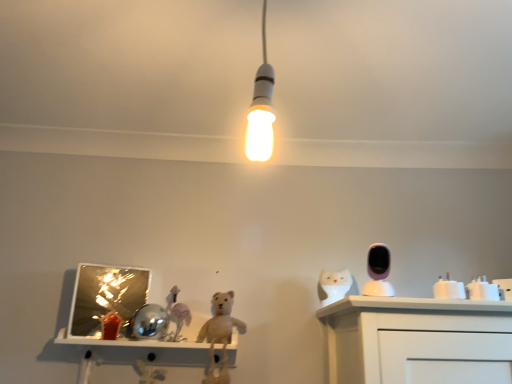
What do you see at coordinates (448, 289) in the screenshot? The height and width of the screenshot is (384, 512). I see `white glossy cup at right, which is the third toy from back to front` at bounding box center [448, 289].

What do you see at coordinates (177, 315) in the screenshot? The height and width of the screenshot is (384, 512). I see `matte pink horse at center, acting as the 4th toy starting from the right` at bounding box center [177, 315].

Where is `matte pink horse at center, acting as the 4th toy starting from the front`? This screenshot has height=384, width=512. matte pink horse at center, acting as the 4th toy starting from the front is located at coordinates pyautogui.click(x=177, y=315).

Where is `white glossy owl at right`? The width and height of the screenshot is (512, 384). white glossy owl at right is located at coordinates (335, 286).

The width and height of the screenshot is (512, 384). What do you see at coordinates (378, 271) in the screenshot?
I see `pink glossy security camera at upper right, which ranks as the 1th toy in front-to-back order` at bounding box center [378, 271].

Locate an element on the screen. This screenshot has height=384, width=512. white glossy cup at right, the 2th toy in the front-to-back sequence is located at coordinates (448, 289).

Consider the image. Is white glossy cup at right, the 2th toy in the front-to-back sequence, not close to white glossy plug at right, placed as the third toy when sorted from front to back?

Actually, white glossy cup at right, the 2th toy in the front-to-back sequence, and white glossy plug at right, placed as the third toy when sorted from front to back, are a little close together.

Considering the sizes of objects white glossy cup at right, which is the third toy from back to front, and white glossy plug at right, which ranks as the 2th toy in back-to-front order, in the image provided, who is thinner, white glossy cup at right, which is the third toy from back to front, or white glossy plug at right, which ranks as the 2th toy in back-to-front order,?

With smaller width is white glossy plug at right, which ranks as the 2th toy in back-to-front order.

Which is farther, (462, 284) or (492, 293)?

Positioned behind is point (462, 284).

From a real-world perspective, is white glossy cup at right, which is the third toy from left to right, under white glossy plug at right, which ranks as the 2th toy in back-to-front order?

Yes, from a real-world perspective, white glossy cup at right, which is the third toy from left to right, is under white glossy plug at right, which ranks as the 2th toy in back-to-front order.

From a real-world perspective, which is physically below, matte pink horse at center, the first toy when ordered from back to front, or white glossy cup at right, which is the third toy from left to right?

From a 3D spatial view, matte pink horse at center, the first toy when ordered from back to front, is below.

Looking at their sizes, would you say matte pink horse at center, acting as the 4th toy starting from the front, is wider or thinner than white glossy cup at right, which is the third toy from left to right?

Considering their sizes, matte pink horse at center, acting as the 4th toy starting from the front, looks broader than white glossy cup at right, which is the third toy from left to right.

Which is more to the left, matte pink horse at center, acting as the 4th toy starting from the front, or white glossy cup at right, the 2th toy in the front-to-back sequence?

matte pink horse at center, acting as the 4th toy starting from the front.

Can you confirm if matte pink horse at center, acting as the 4th toy starting from the front, is taller than white glossy cup at right, which is the third toy from left to right?

Yes, matte pink horse at center, acting as the 4th toy starting from the front, is taller than white glossy cup at right, which is the third toy from left to right.

The image size is (512, 384). Identify the location of animal above the white glossy cup at right, which is the third toy from back to front (from a real-world perspective). (335, 286).

Is white glossy cup at right, which is the third toy from left to right, to the right of white glossy owl at right from the viewer's perspective?

Correct, you'll find white glossy cup at right, which is the third toy from left to right, to the right of white glossy owl at right.

In terms of height, does white glossy cup at right, which is the third toy from left to right, look taller or shorter compared to white glossy owl at right?

Clearly, white glossy cup at right, which is the third toy from left to right, is shorter compared to white glossy owl at right.

Which object is wider, pink glossy security camera at upper right, which is the 2th toy from left to right, or white glossy cup at right, the 2th toy in the front-to-back sequence?

pink glossy security camera at upper right, which is the 2th toy from left to right, is wider.

Is pink glossy security camera at upper right, the third toy in the right-to-left sequence, next to white glossy cup at right, the 2th toy in the front-to-back sequence?

They are not placed beside each other.

In the scene shown: Do you think pink glossy security camera at upper right, the third toy in the right-to-left sequence, is within white glossy cup at right, which is the third toy from back to front, or outside of it?

pink glossy security camera at upper right, the third toy in the right-to-left sequence, exists outside the volume of white glossy cup at right, which is the third toy from back to front.

Considering the sizes of objects matte pink horse at center, the first toy when ordered from back to front, and pink glossy security camera at upper right, which ranks as the 1th toy in front-to-back order, in the image provided, who is bigger, matte pink horse at center, the first toy when ordered from back to front, or pink glossy security camera at upper right, which ranks as the 1th toy in front-to-back order,?

With larger size is matte pink horse at center, the first toy when ordered from back to front.

Considering the relative sizes of matte pink horse at center, acting as the 4th toy starting from the right, and pink glossy security camera at upper right, which is the 2th toy from left to right, in the image provided, is matte pink horse at center, acting as the 4th toy starting from the right, taller than pink glossy security camera at upper right, which is the 2th toy from left to right,?

Yes, matte pink horse at center, acting as the 4th toy starting from the right, is taller than pink glossy security camera at upper right, which is the 2th toy from left to right.

From a real-world perspective, is matte pink horse at center, placed as the 1th toy when sorted from left to right, under pink glossy security camera at upper right, the fourth toy in the back-to-front sequence?

Yes, from a real-world perspective, matte pink horse at center, placed as the 1th toy when sorted from left to right, is under pink glossy security camera at upper right, the fourth toy in the back-to-front sequence.

Is matte pink horse at center, the first toy when ordered from back to front, facing towards pink glossy security camera at upper right, the third toy in the right-to-left sequence?

No, matte pink horse at center, the first toy when ordered from back to front, is not aimed at pink glossy security camera at upper right, the third toy in the right-to-left sequence.

From a real-world perspective, which object stands above the other?

From a 3D spatial view, pink glossy security camera at upper right, the fourth toy in the back-to-front sequence, is above.

Is pink glossy security camera at upper right, which ranks as the 1th toy in front-to-back order, inside or outside of matte pink horse at center, acting as the 4th toy starting from the front?

pink glossy security camera at upper right, which ranks as the 1th toy in front-to-back order, exists outside the volume of matte pink horse at center, acting as the 4th toy starting from the front.

In the scene shown: How many degrees apart are the facing directions of pink glossy security camera at upper right, which ranks as the 1th toy in front-to-back order, and matte pink horse at center, the first toy when ordered from back to front?

The angle between the facing direction of pink glossy security camera at upper right, which ranks as the 1th toy in front-to-back order, and the facing direction of matte pink horse at center, the first toy when ordered from back to front, is 5.94 degrees.

Considering the sizes of pink glossy security camera at upper right, the fourth toy in the back-to-front sequence, and matte pink horse at center, the first toy when ordered from back to front, in the image, is pink glossy security camera at upper right, the fourth toy in the back-to-front sequence, wider or thinner than matte pink horse at center, the first toy when ordered from back to front,?

In the image, pink glossy security camera at upper right, the fourth toy in the back-to-front sequence, appears to be more narrow than matte pink horse at center, the first toy when ordered from back to front.

Who is bigger, pink glossy security camera at upper right, the fourth toy in the back-to-front sequence, or white glossy plug at right, which ranks as the 2th toy in back-to-front order?

With larger size is pink glossy security camera at upper right, the fourth toy in the back-to-front sequence.

Is pink glossy security camera at upper right, which is the 2th toy from left to right, located outside white glossy plug at right, which is the 1th toy from right to left?

pink glossy security camera at upper right, which is the 2th toy from left to right, is positioned outside white glossy plug at right, which is the 1th toy from right to left.

Which is behind, point (373, 293) or point (481, 292)?

The point (373, 293) is behind.

At what (x,y) coordinates should I click in order to perform the action: click on the 1st toy in front of the white glossy plug at right, the 4th toy positioned from the left, counting from the anchor's position. Please return your answer as a coordinate pair (x, y). Looking at the image, I should click on (448, 289).

From the white glossy cup at right, the 2th toy in the front-to-back sequence, count the 2nd toy to the left and point to it. Please provide its 2D coordinates.

[(177, 315)]

From the image, which object appears to be nearer to white glossy cup at right, which is the third toy from back to front, pink glossy security camera at upper right, the third toy in the right-to-left sequence, or white glossy owl at right?

Based on the image, pink glossy security camera at upper right, the third toy in the right-to-left sequence, appears to be nearer to white glossy cup at right, which is the third toy from back to front.

Considering their positions, is white glossy cup at right, which is the third toy from left to right, positioned closer to white glossy plug at right, placed as the third toy when sorted from front to back, than pink glossy security camera at upper right, which ranks as the 1th toy in front-to-back order?

Based on the image, white glossy cup at right, which is the third toy from left to right, appears to be nearer to white glossy plug at right, placed as the third toy when sorted from front to back.

Estimate the real-world distances between objects in this image. Which object is further from pink glossy security camera at upper right, the fourth toy in the back-to-front sequence, white glossy cup at right, the 2th toy in the front-to-back sequence, or matte pink horse at center, acting as the 4th toy starting from the right?

Based on the image, matte pink horse at center, acting as the 4th toy starting from the right, appears to be further to pink glossy security camera at upper right, the fourth toy in the back-to-front sequence.

When comparing their distances from matte pink horse at center, acting as the 4th toy starting from the front, does pink glossy security camera at upper right, which is the 2th toy from left to right, or white glossy plug at right, which is the 1th toy from right to left, seem closer?

The object closer to matte pink horse at center, acting as the 4th toy starting from the front, is pink glossy security camera at upper right, which is the 2th toy from left to right.

Which object lies nearer to the anchor point white glossy plug at right, which ranks as the 2th toy in back-to-front order, white glossy cup at right, which is the third toy from left to right, or white glossy owl at right?

Based on the image, white glossy cup at right, which is the third toy from left to right, appears to be nearer to white glossy plug at right, which ranks as the 2th toy in back-to-front order.

Looking at this image, based on their spatial positions, is matte pink horse at center, acting as the 4th toy starting from the right, or white glossy plug at right, which ranks as the 2th toy in back-to-front order, further from white glossy cup at right, the 2th toy in the right-to-left sequence?

Among the two, matte pink horse at center, acting as the 4th toy starting from the right, is located further to white glossy cup at right, the 2th toy in the right-to-left sequence.

Estimate the real-world distances between objects in this image. Which object is closer to white glossy owl at right, pink glossy security camera at upper right, which is the 2th toy from left to right, or white glossy plug at right, which ranks as the 2th toy in back-to-front order?

pink glossy security camera at upper right, which is the 2th toy from left to right.

Considering their positions, is matte pink horse at center, acting as the 4th toy starting from the right, positioned further to white glossy plug at right, which is the 1th toy from right to left, than white glossy owl at right?

matte pink horse at center, acting as the 4th toy starting from the right.

Identify the location of animal situated between matte pink horse at center, acting as the 4th toy starting from the front, and white glossy cup at right, which is the third toy from left to right, from left to right. Image resolution: width=512 pixels, height=384 pixels. (x=335, y=286).

Where is `toy situated between matte pink horse at center, placed as the 1th toy when sorted from left to right, and white glossy cup at right, which is the third toy from left to right, from left to right`? toy situated between matte pink horse at center, placed as the 1th toy when sorted from left to right, and white glossy cup at right, which is the third toy from left to right, from left to right is located at coordinates (378, 271).

Where is `animal located between matte pink horse at center, the first toy when ordered from back to front, and pink glossy security camera at upper right, which is the 2th toy from left to right, in the left-right direction`? This screenshot has width=512, height=384. animal located between matte pink horse at center, the first toy when ordered from back to front, and pink glossy security camera at upper right, which is the 2th toy from left to right, in the left-right direction is located at coordinates (335, 286).

You are a GUI agent. You are given a task and a screenshot of the screen. Output one action in this format:
    pyautogui.click(x=<x>, y=<y>)
    Task: Click on the toy situated between pink glossy security camera at upper right, the fourth toy in the back-to-front sequence, and white glossy plug at right, which ranks as the 2th toy in back-to-front order, from left to right
    The height and width of the screenshot is (384, 512).
    Given the screenshot: What is the action you would take?
    pyautogui.click(x=448, y=289)